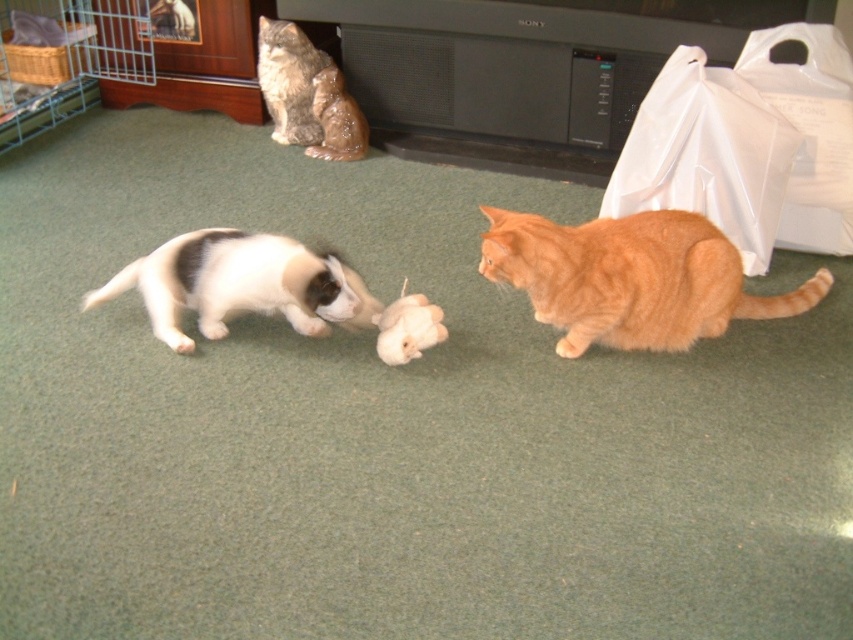
Question: From the image, what is the correct spatial relationship of white fur at center in relation to gray tabby cat at upper left?

Choices:
 (A) above
 (B) below

Answer: (B)

Question: Which object is farther from the camera taking this photo?

Choices:
 (A) white fur at center
 (B) white plush mouse at center
 (C) orange fur cat at center

Answer: (B)

Question: Is orange fur cat at center positioned in front of white fur at center?

Choices:
 (A) yes
 (B) no

Answer: (A)

Question: Does gray tabby cat at upper left appear on the left side of white plush mouse at center?

Choices:
 (A) no
 (B) yes

Answer: (B)

Question: Which object is the farthest from the white fur at center?

Choices:
 (A) gray tabby cat at upper left
 (B) transparent plastic bag at upper right

Answer: (B)

Question: Which of the following is the closest to the observer?

Choices:
 (A) white plastic bag at upper right
 (B) transparent plastic bag at upper right
 (C) white plush mouse at center
 (D) orange fur cat at center

Answer: (D)